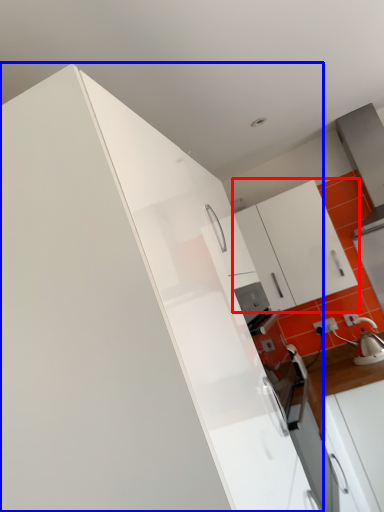
Question: Which object appears closest to the camera in this image, cabinetry (highlighted by a red box) or cabinetry (highlighted by a blue box)?

Choices:
 (A) cabinetry
 (B) cabinetry

Answer: (B)